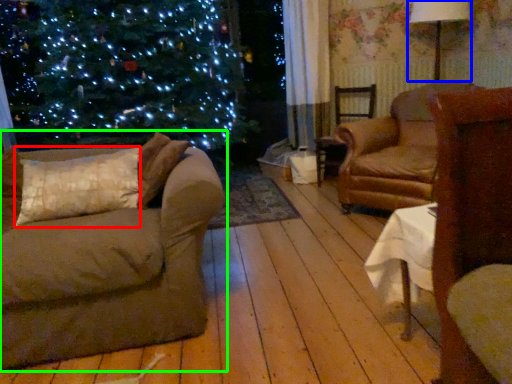
Question: Considering the real-world distances, which object is closest to pillow (highlighted by a red box)? lamp (highlighted by a blue box) or studio couch (highlighted by a green box).

Choices:
 (A) lamp
 (B) studio couch

Answer: (B)